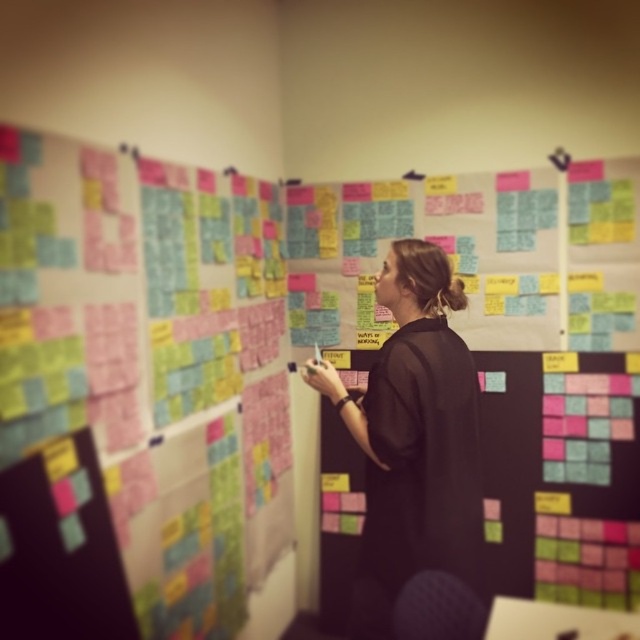
Who is shorter, multicolored sticky notes at left or black matte dress at center?

black matte dress at center is shorter.

Measure the distance from multicolored sticky notes at left to black matte dress at center.

The distance of multicolored sticky notes at left from black matte dress at center is 26.28 inches.

Find the location of a particular element. This screenshot has width=640, height=640. multicolored sticky notes at left is located at coordinates (144, 365).